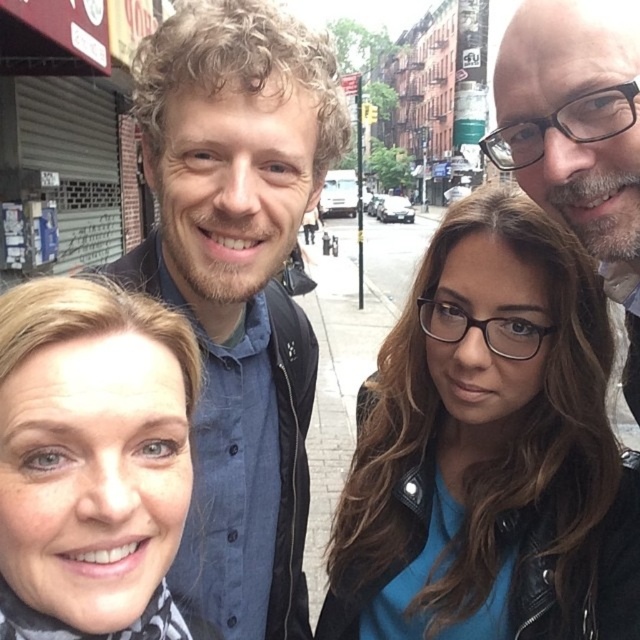
Question: Where is matte black scarf at lower left located in relation to bald head at upper right in the image?

Choices:
 (A) left
 (B) right

Answer: (A)

Question: Can you confirm if matte black scarf at lower left is positioned to the left of bald head at upper right?

Choices:
 (A) no
 (B) yes

Answer: (B)

Question: Which is farther from the blue matte jacket at center?

Choices:
 (A) bald head at upper right
 (B) matte black scarf at lower left

Answer: (B)

Question: Which point is farther from the camera taking this photo?

Choices:
 (A) pos(440,448)
 (B) pos(625,35)

Answer: (A)

Question: Estimate the real-world distances between objects in this image. Which object is closer to the blue denim shirt at center?

Choices:
 (A) bald head at upper right
 (B) blue matte jacket at center

Answer: (B)

Question: Does blue denim shirt at center have a lesser width compared to matte black scarf at lower left?

Choices:
 (A) no
 (B) yes

Answer: (A)